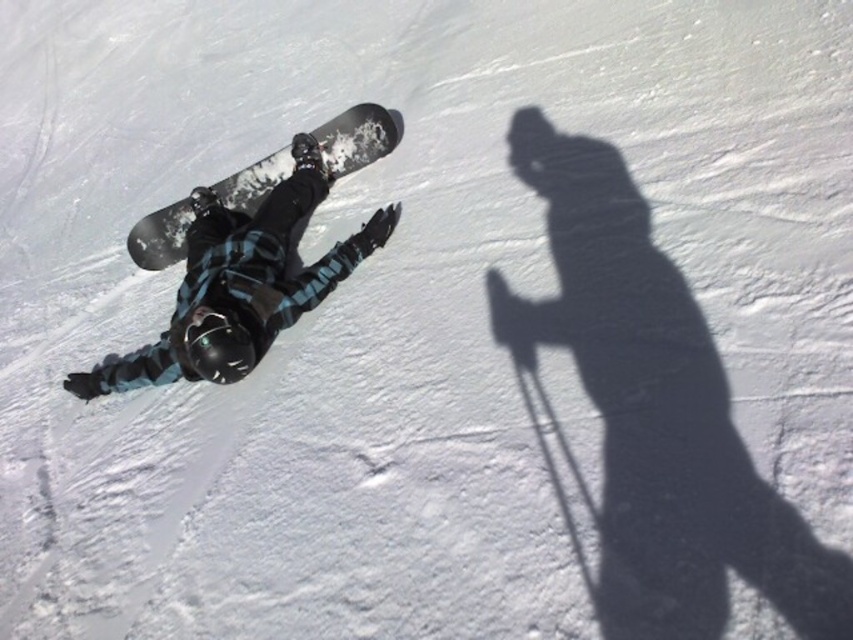
Who is more forward, (x=102, y=392) or (x=164, y=224)?

Positioned in front is point (x=102, y=392).

Does matte black snowboard at center appear under black matte snowboard at center?

Correct, matte black snowboard at center is located below black matte snowboard at center.

You are a GUI agent. You are given a task and a screenshot of the screen. Output one action in this format:
    pyautogui.click(x=<x>, y=<y>)
    Task: Click on the matte black snowboard at center
    The height and width of the screenshot is (640, 853).
    Given the screenshot: What is the action you would take?
    pyautogui.click(x=241, y=284)